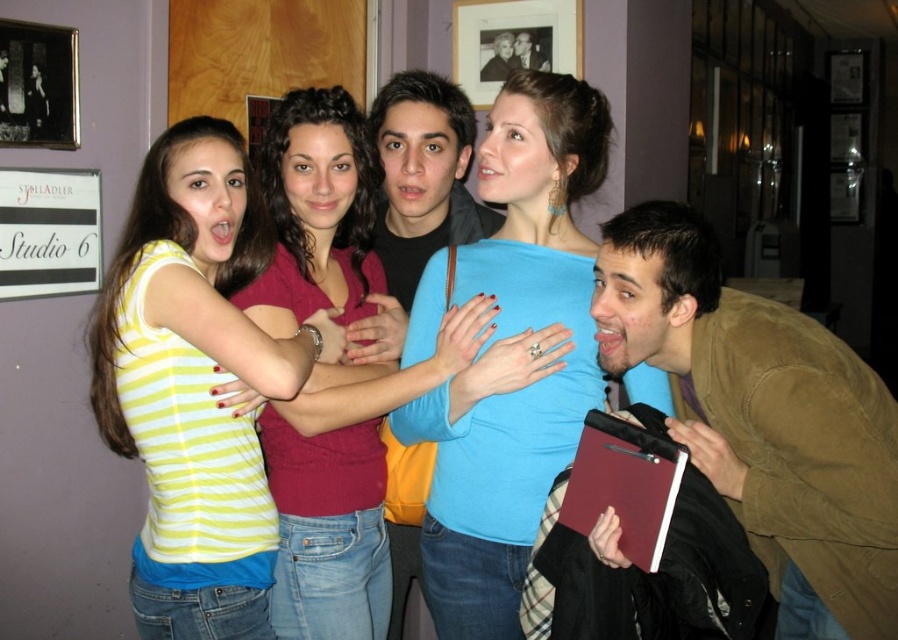
Between matte black shirt at center and smooth brown leather jacket at center, which one is positioned higher?

Positioned higher is smooth brown leather jacket at center.

Does matte black shirt at center appear over smooth brown leather jacket at center?

Actually, matte black shirt at center is below smooth brown leather jacket at center.

Which is behind, point (433, 118) or point (534, 65)?

The point (534, 65) is more distant.

Locate an element on the screen. This screenshot has width=898, height=640. matte black shirt at center is located at coordinates (423, 176).

How much distance is there between matte maroon top at center and smooth brown leather jacket at center?

4.01 feet

Between matte maroon top at center and smooth brown leather jacket at center, which one has more height?

matte maroon top at center is taller.

Is point (327, 161) closer to camera compared to point (542, 51)?

Yes, it is.

Locate an element on the screen. The width and height of the screenshot is (898, 640). matte maroon top at center is located at coordinates (335, 499).

Which of these two, matte maroon top at center or matte black jacket at upper center, stands taller?

matte maroon top at center

Between matte maroon top at center and matte black jacket at upper center, which one is positioned lower?

matte maroon top at center

You are a GUI agent. You are given a task and a screenshot of the screen. Output one action in this format:
    pyautogui.click(x=<x>, y=<y>)
    Task: Click on the matte maroon top at center
    The image size is (898, 640).
    Given the screenshot: What is the action you would take?
    pyautogui.click(x=335, y=499)

I want to click on matte maroon top at center, so click(335, 499).